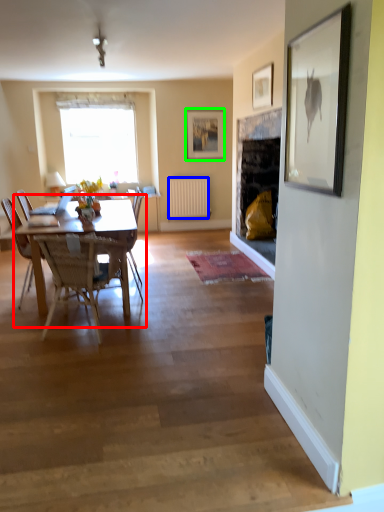
Question: Which object is the closest to the kitchen & dining room table (highlighted by a red box)? Choose among these: radiator (highlighted by a blue box) or picture frame (highlighted by a green box).

Choices:
 (A) radiator
 (B) picture frame

Answer: (A)